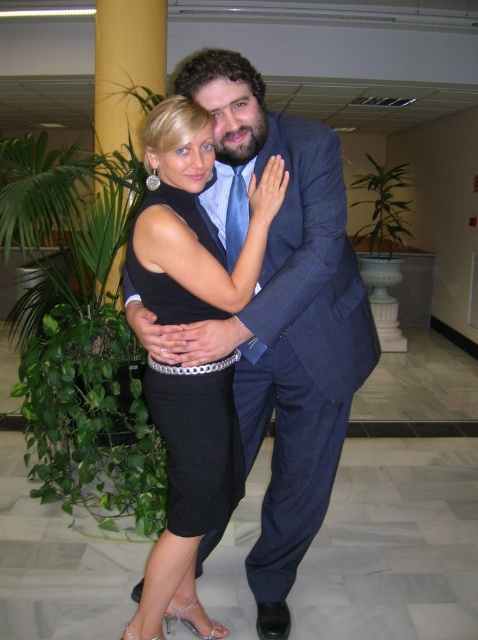
The width and height of the screenshot is (478, 640). What do you see at coordinates (185, 497) in the screenshot?
I see `satin black dress at center` at bounding box center [185, 497].

This screenshot has height=640, width=478. I want to click on satin black dress at center, so click(185, 497).